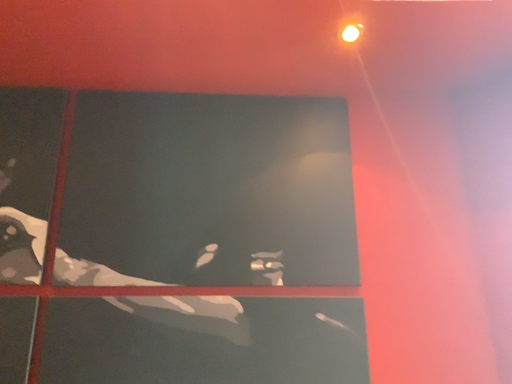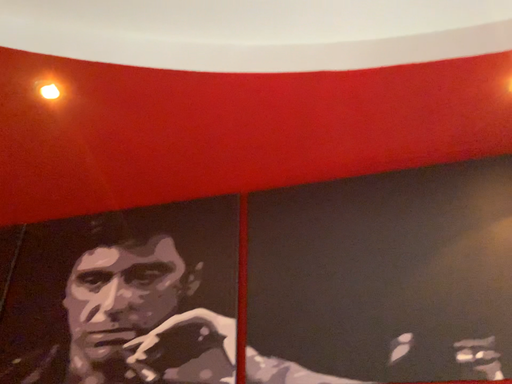
Question: Which way did the camera rotate in the video?

Choices:
 (A) rotated upward
 (B) rotated downward

Answer: (A)